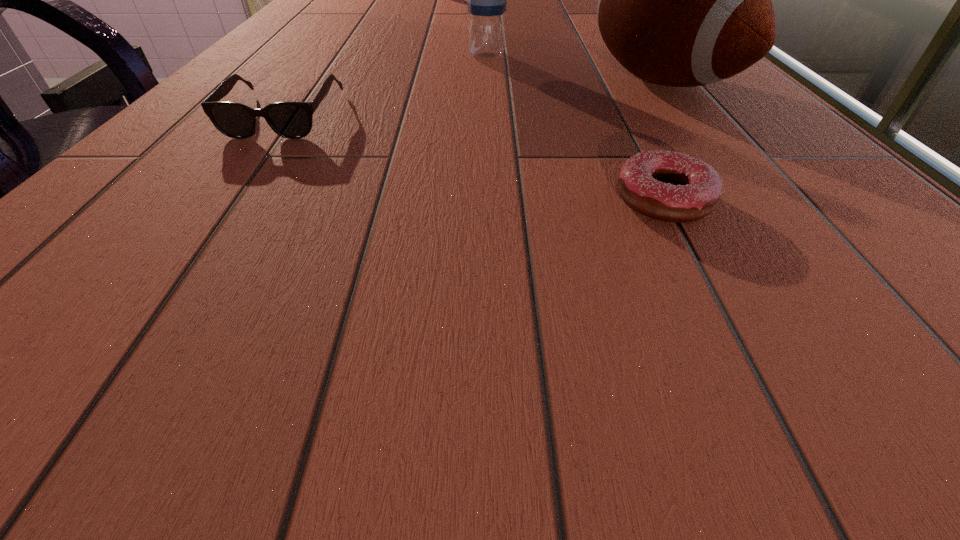
This screenshot has width=960, height=540. In order to click on vacant spot on the desktop that is between the third tallest object and the nearest object and is positioned on the label of the second object from left to right in this screenshot , I will do 501,164.

In order to click on free space on the desktop that is between the second shortest object and the shortest object and is positioned on the laces of the football in this screenshot , I will do `click(409, 143)`.